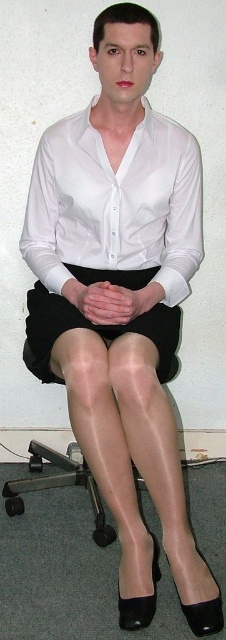
Can you confirm if white satin shirt at center is smaller than black tights at center?

Actually, white satin shirt at center might be larger than black tights at center.

How distant is white satin shirt at center from black tights at center?

white satin shirt at center and black tights at center are 6.06 inches apart.

You are a GUI agent. You are given a task and a screenshot of the screen. Output one action in this format:
    pyautogui.click(x=<x>, y=<y>)
    Task: Click on the white satin shirt at center
    
    Given the screenshot: What is the action you would take?
    pyautogui.click(x=115, y=204)

Find the location of a particular element. The width and height of the screenshot is (226, 640). white satin shirt at center is located at coordinates (115, 204).